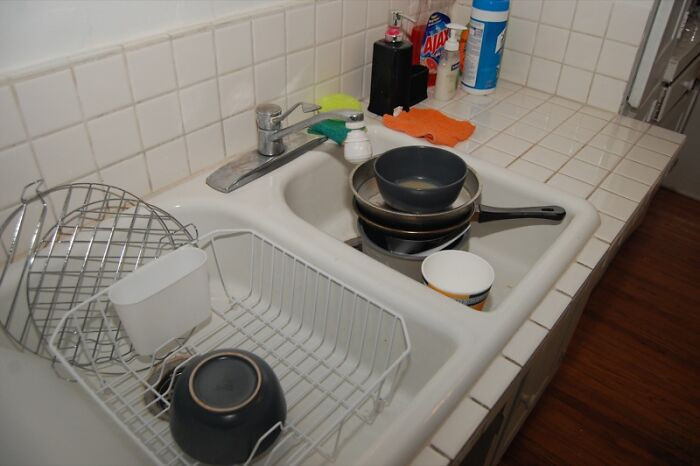
What are the coordinates of `cup` in the screenshot? It's located at (465, 285).